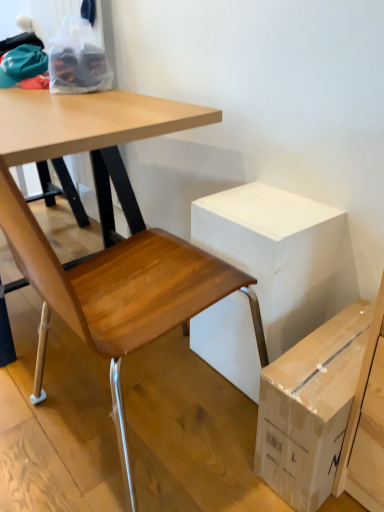
Question: Is white cardboard box at center closer to the viewer compared to brown cardboard box at lower right?

Choices:
 (A) yes
 (B) no

Answer: (B)

Question: Is white cardboard box at center thinner than brown cardboard box at lower right?

Choices:
 (A) yes
 (B) no

Answer: (A)

Question: Is white cardboard box at center completely or partially outside of brown cardboard box at lower right?

Choices:
 (A) no
 (B) yes

Answer: (B)

Question: Does white cardboard box at center have a larger size compared to brown cardboard box at lower right?

Choices:
 (A) no
 (B) yes

Answer: (B)

Question: Can you confirm if white cardboard box at center is smaller than brown cardboard box at lower right?

Choices:
 (A) yes
 (B) no

Answer: (B)

Question: Is white cardboard box at center to the right of brown cardboard box at lower right from the viewer's perspective?

Choices:
 (A) no
 (B) yes

Answer: (A)

Question: Would you say brown cardboard box at lower right is outside wooden chair at lower left?

Choices:
 (A) yes
 (B) no

Answer: (A)

Question: Is brown cardboard box at lower right closer to the viewer compared to wooden chair at lower left?

Choices:
 (A) yes
 (B) no

Answer: (B)

Question: Is brown cardboard box at lower right wider than wooden chair at lower left?

Choices:
 (A) no
 (B) yes

Answer: (A)

Question: Could you tell me if brown cardboard box at lower right is turned towards wooden chair at lower left?

Choices:
 (A) no
 (B) yes

Answer: (A)

Question: From the image's perspective, is brown cardboard box at lower right beneath wooden chair at lower left?

Choices:
 (A) no
 (B) yes

Answer: (B)

Question: Can you see brown cardboard box at lower right touching wooden chair at lower left?

Choices:
 (A) no
 (B) yes

Answer: (A)

Question: Is white cardboard box at center positioned in front of wooden chair at lower left?

Choices:
 (A) yes
 (B) no

Answer: (B)